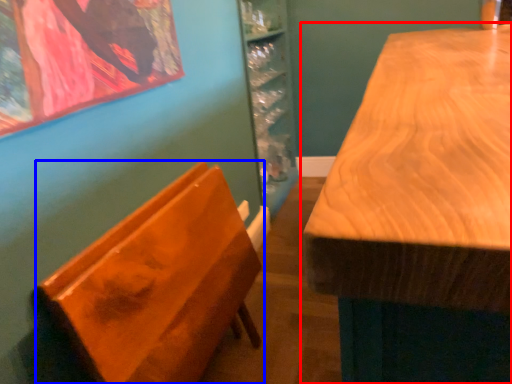
Question: Which point is further to the camera, table (highlighted by a red box) or furniture (highlighted by a blue box)?

Choices:
 (A) table
 (B) furniture

Answer: (B)